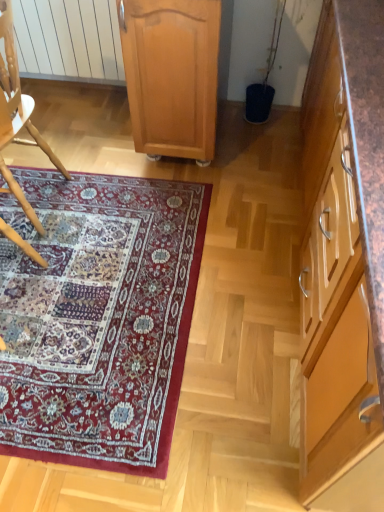
Measure the distance between point (x=163, y=146) and camera.

Point (x=163, y=146) and camera are 2.07 meters apart.

The width and height of the screenshot is (384, 512). Describe the element at coordinates (17, 113) in the screenshot. I see `wooden chair at left` at that location.

You are a GUI agent. You are given a task and a screenshot of the screen. Output one action in this format:
    pyautogui.click(x=<x>, y=<y>)
    Task: Click on the brown wood cabinet at right, arranged as the first cabinetry when viewed from the right
    This screenshot has height=512, width=384.
    Given the screenshot: What is the action you would take?
    pyautogui.click(x=342, y=245)

Considering the relative sizes of brown wood cabinet at right, the 2th cabinetry positioned from the left, and wooden chair at left in the image provided, is brown wood cabinet at right, the 2th cabinetry positioned from the left, shorter than wooden chair at left?

Incorrect, the height of brown wood cabinet at right, the 2th cabinetry positioned from the left, does not fall short of that of wooden chair at left.

Considering the positions of objects brown wood cabinet at right, the 2th cabinetry positioned from the left, and wooden chair at left in the image provided, who is more to the left, brown wood cabinet at right, the 2th cabinetry positioned from the left, or wooden chair at left?

Positioned to the left is wooden chair at left.

From the image's perspective, would you say brown wood cabinet at right, the 2th cabinetry positioned from the left, is shown under wooden chair at left?

Indeed, from the image's perspective, brown wood cabinet at right, the 2th cabinetry positioned from the left, is shown beneath wooden chair at left.

Is wooden chair at left surrounded by brown wood cabinet at right, arranged as the first cabinetry when viewed from the right?

No.

Is light brown wood cabinet at center, arranged as the 2th cabinetry when viewed from the right, at the back of wooden chair at left?

No, wooden chair at left is not facing away from light brown wood cabinet at center, arranged as the 2th cabinetry when viewed from the right.

Would you say wooden chair at left is inside or outside light brown wood cabinet at center, arranged as the 2th cabinetry when viewed from the right?

wooden chair at left is not enclosed by light brown wood cabinet at center, arranged as the 2th cabinetry when viewed from the right.

How distant is wooden chair at left from light brown wood cabinet at center, which is the first cabinetry from left to right?

The distance of wooden chair at left from light brown wood cabinet at center, which is the first cabinetry from left to right, is 23.63 inches.

Is wooden chair at left at the right side of light brown wood cabinet at center, which is the first cabinetry from left to right?

Incorrect, wooden chair at left is not on the right side of light brown wood cabinet at center, which is the first cabinetry from left to right.

Consider the image. Is brown wood cabinet at right, arranged as the first cabinetry when viewed from the right, not near light brown wood cabinet at center, which is the first cabinetry from left to right?

brown wood cabinet at right, arranged as the first cabinetry when viewed from the right, is near light brown wood cabinet at center, which is the first cabinetry from left to right, not far away.

Is brown wood cabinet at right, arranged as the first cabinetry when viewed from the right, turned away from light brown wood cabinet at center, arranged as the 2th cabinetry when viewed from the right?

That's not correct — brown wood cabinet at right, arranged as the first cabinetry when viewed from the right, is not looking away from light brown wood cabinet at center, arranged as the 2th cabinetry when viewed from the right.

Which is closer to the camera, (376, 390) or (156, 149)?

The point (376, 390) is closer.

Can you tell me how much brown wood cabinet at right, arranged as the first cabinetry when viewed from the right, and light brown wood cabinet at center, arranged as the 2th cabinetry when viewed from the right, differ in facing direction?

brown wood cabinet at right, arranged as the first cabinetry when viewed from the right, and light brown wood cabinet at center, arranged as the 2th cabinetry when viewed from the right, are facing 91.2 degrees away from each other.

From the image's perspective, does carpet with intricate patterns at lower left appear higher than light brown wood cabinet at center, which is the first cabinetry from left to right?

Incorrect, from the image's perspective, carpet with intricate patterns at lower left is lower than light brown wood cabinet at center, which is the first cabinetry from left to right.

In the scene shown: Which of these two, carpet with intricate patterns at lower left or light brown wood cabinet at center, which is the first cabinetry from left to right, is thinner?

light brown wood cabinet at center, which is the first cabinetry from left to right, is thinner.

Considering the positions of point (64, 281) and point (168, 93), is point (64, 281) closer or farther from the camera than point (168, 93)?

Point (64, 281) is closer to the camera than point (168, 93).

Is the depth of carpet with intricate patterns at lower left greater than that of light brown wood cabinet at center, which is the first cabinetry from left to right?

That is False.

Based on the photo, can you confirm if wooden chair at left is positioned to the left of brown wood cabinet at right, the 2th cabinetry positioned from the left?

Yes.

Does wooden chair at left turn towards brown wood cabinet at right, arranged as the first cabinetry when viewed from the right?

No, wooden chair at left is not aimed at brown wood cabinet at right, arranged as the first cabinetry when viewed from the right.

Does wooden chair at left have a greater width compared to brown wood cabinet at right, arranged as the first cabinetry when viewed from the right?

Incorrect, the width of wooden chair at left does not surpass that of brown wood cabinet at right, arranged as the first cabinetry when viewed from the right.

Is point (39, 145) in front of point (351, 279)?

That is False.

From a real-world perspective, between light brown wood cabinet at center, which is the first cabinetry from left to right, and carpet with intricate patterns at lower left, who is vertically higher?

In real-world perspective, light brown wood cabinet at center, which is the first cabinetry from left to right, is above.

Is the depth of light brown wood cabinet at center, arranged as the 2th cabinetry when viewed from the right, less than that of carpet with intricate patterns at lower left?

No, light brown wood cabinet at center, arranged as the 2th cabinetry when viewed from the right, is further to the viewer.

Can you confirm if light brown wood cabinet at center, arranged as the 2th cabinetry when viewed from the right, is thinner than carpet with intricate patterns at lower left?

Yes, light brown wood cabinet at center, arranged as the 2th cabinetry when viewed from the right, is thinner than carpet with intricate patterns at lower left.

Is wooden chair at left thinner than carpet with intricate patterns at lower left?

Indeed, wooden chair at left has a lesser width compared to carpet with intricate patterns at lower left.

Is wooden chair at left facing towards carpet with intricate patterns at lower left?

No, wooden chair at left is not facing towards carpet with intricate patterns at lower left.

From the picture: Considering the relative sizes of wooden chair at left and carpet with intricate patterns at lower left in the image provided, is wooden chair at left smaller than carpet with intricate patterns at lower left?

Incorrect, wooden chair at left is not smaller in size than carpet with intricate patterns at lower left.

Identify the location of chair behind the brown wood cabinet at right, arranged as the first cabinetry when viewed from the right. (17, 113).

At what (x,y) coordinates should I click in order to perform the action: click on the 1st cabinetry to the right of the wooden chair at left, counting from the anchor's position. Please return your answer as a coordinate pair (x, y). This screenshot has height=512, width=384. Looking at the image, I should click on point(172,75).

Estimate the real-world distances between objects in this image. Which object is closer to wooden chair at left, carpet with intricate patterns at lower left or light brown wood cabinet at center, arranged as the 2th cabinetry when viewed from the right?

The object closer to wooden chair at left is carpet with intricate patterns at lower left.

Which object lies further to the anchor point carpet with intricate patterns at lower left, brown wood cabinet at right, arranged as the first cabinetry when viewed from the right, or light brown wood cabinet at center, arranged as the 2th cabinetry when viewed from the right?

The object further to carpet with intricate patterns at lower left is brown wood cabinet at right, arranged as the first cabinetry when viewed from the right.

When comparing their distances from wooden chair at left, does light brown wood cabinet at center, which is the first cabinetry from left to right, or carpet with intricate patterns at lower left seem closer?

carpet with intricate patterns at lower left is positioned closer to the anchor wooden chair at left.

In the scene shown: Based on their spatial positions, is light brown wood cabinet at center, which is the first cabinetry from left to right, or wooden chair at left closer to brown wood cabinet at right, the 2th cabinetry positioned from the left?

light brown wood cabinet at center, which is the first cabinetry from left to right.

In the scene shown: Which object lies nearer to the anchor point carpet with intricate patterns at lower left, brown wood cabinet at right, arranged as the first cabinetry when viewed from the right, or wooden chair at left?

wooden chair at left lies closer to carpet with intricate patterns at lower left than the other object.

Based on their spatial positions, is wooden chair at left or carpet with intricate patterns at lower left closer to light brown wood cabinet at center, which is the first cabinetry from left to right?

wooden chair at left is closer to light brown wood cabinet at center, which is the first cabinetry from left to right.

Looking at the image, which one is located further to brown wood cabinet at right, the 2th cabinetry positioned from the left, wooden chair at left or light brown wood cabinet at center, arranged as the 2th cabinetry when viewed from the right?

Among the two, wooden chair at left is located further to brown wood cabinet at right, the 2th cabinetry positioned from the left.

Based on their spatial positions, is light brown wood cabinet at center, which is the first cabinetry from left to right, or carpet with intricate patterns at lower left closer to brown wood cabinet at right, arranged as the first cabinetry when viewed from the right?

carpet with intricate patterns at lower left is closer to brown wood cabinet at right, arranged as the first cabinetry when viewed from the right.

Identify the location of cabinetry between wooden chair at left and brown wood cabinet at right, arranged as the first cabinetry when viewed from the right. The height and width of the screenshot is (512, 384). (172, 75).

Image resolution: width=384 pixels, height=512 pixels. I want to click on chair between light brown wood cabinet at center, which is the first cabinetry from left to right, and carpet with intricate patterns at lower left vertically, so click(17, 113).

At what (x,y) coordinates should I click in order to perform the action: click on cabinetry between carpet with intricate patterns at lower left and brown wood cabinet at right, arranged as the first cabinetry when viewed from the right, in the horizontal direction. Please return your answer as a coordinate pair (x, y). This screenshot has height=512, width=384. Looking at the image, I should click on (172, 75).

This screenshot has height=512, width=384. I want to click on mat between wooden chair at left and brown wood cabinet at right, the 2th cabinetry positioned from the left, in the horizontal direction, so click(x=98, y=318).